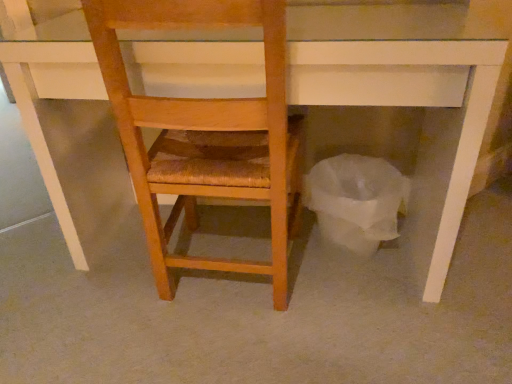
In order to click on free space between wooden chair at center and white paper bag at lower right in this screenshot , I will do click(310, 276).